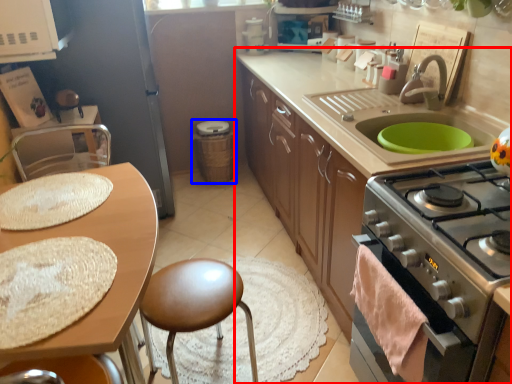
Question: Which of the following is the closest to the observer, cabinetry (highlighted by a red box) or appliance (highlighted by a blue box)?

Choices:
 (A) cabinetry
 (B) appliance

Answer: (A)